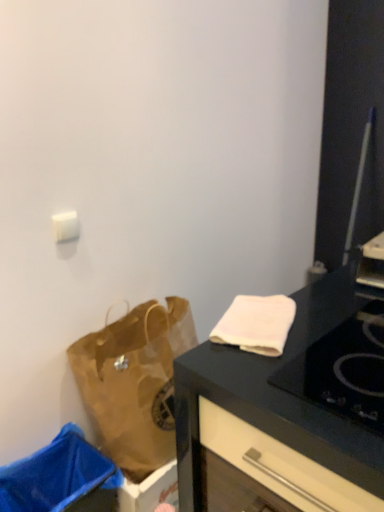
Image resolution: width=384 pixels, height=512 pixels. I want to click on free space above black glass gas stove at upper right (from a real-world perspective), so click(357, 358).